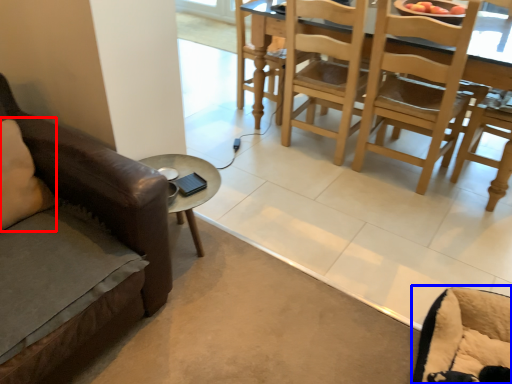
Question: Which point is further to the camera, pillow (highlighted by a red box) or swivel chair (highlighted by a blue box)?

Choices:
 (A) pillow
 (B) swivel chair

Answer: (A)